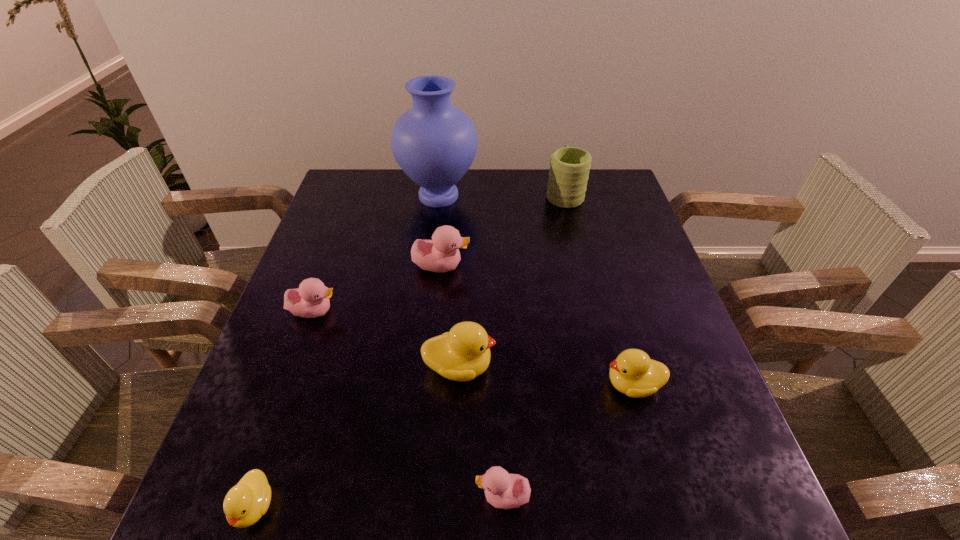
This screenshot has width=960, height=540. Find the location of `vacant region located 0.400m on the beak of the rightmost duckling`. vacant region located 0.400m on the beak of the rightmost duckling is located at coordinates (405, 384).

You are a GUI agent. You are given a task and a screenshot of the screen. Output one action in this format:
    pyautogui.click(x=<x>, y=<y>)
    Task: Click on the vacant space located 0.260m on the front-facing side of the rightmost pink duckling
    The width and height of the screenshot is (960, 540).
    Given the screenshot: What is the action you would take?
    pyautogui.click(x=321, y=496)

Where is `free location located 0.340m on the front-facing side of the rightmost pink duckling`? The width and height of the screenshot is (960, 540). free location located 0.340m on the front-facing side of the rightmost pink duckling is located at coordinates [x=273, y=496].

Where is `free space located 0.220m on the front-facing side of the rightmost pink duckling`? This screenshot has height=540, width=960. free space located 0.220m on the front-facing side of the rightmost pink duckling is located at coordinates (344, 496).

This screenshot has width=960, height=540. I want to click on vase present at the far edge, so click(434, 143).

The image size is (960, 540). I want to click on mug that is at the far edge, so click(569, 167).

The image size is (960, 540). Find the location of `mug that is at the right edge`. mug that is at the right edge is located at coordinates (569, 167).

Where is `duckling located at the right edge`? duckling located at the right edge is located at coordinates (633, 373).

The image size is (960, 540). In order to click on object present at the near left corner in this screenshot , I will do `click(245, 503)`.

Find the location of `object that is at the far right corner`. object that is at the far right corner is located at coordinates (569, 167).